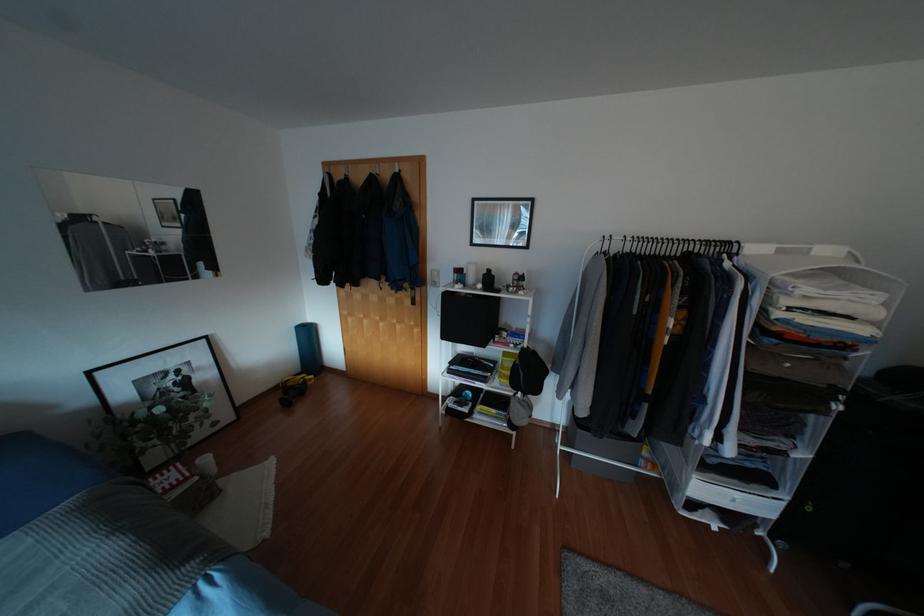
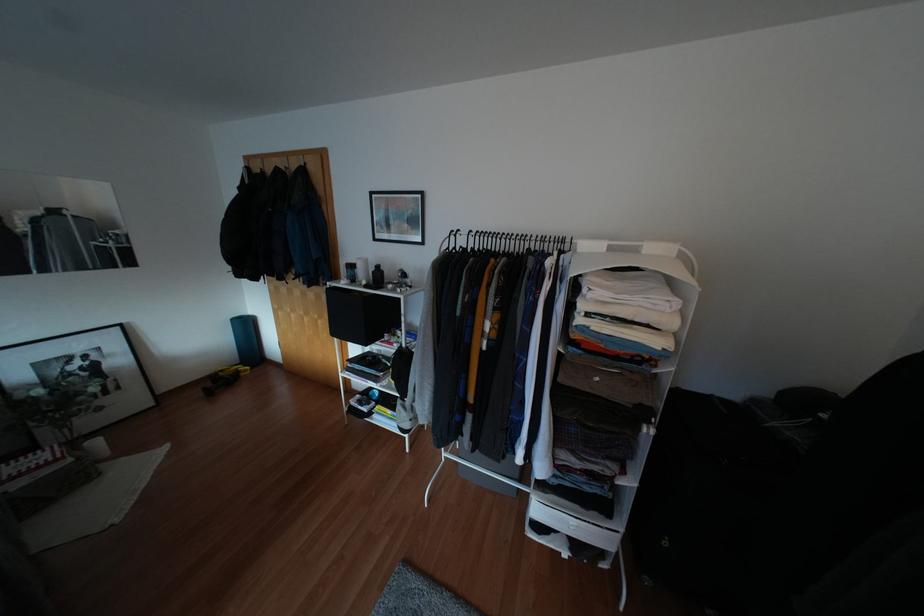
Where in the second image is the point corresponding to point (488, 270) from the first image?

(377, 265)